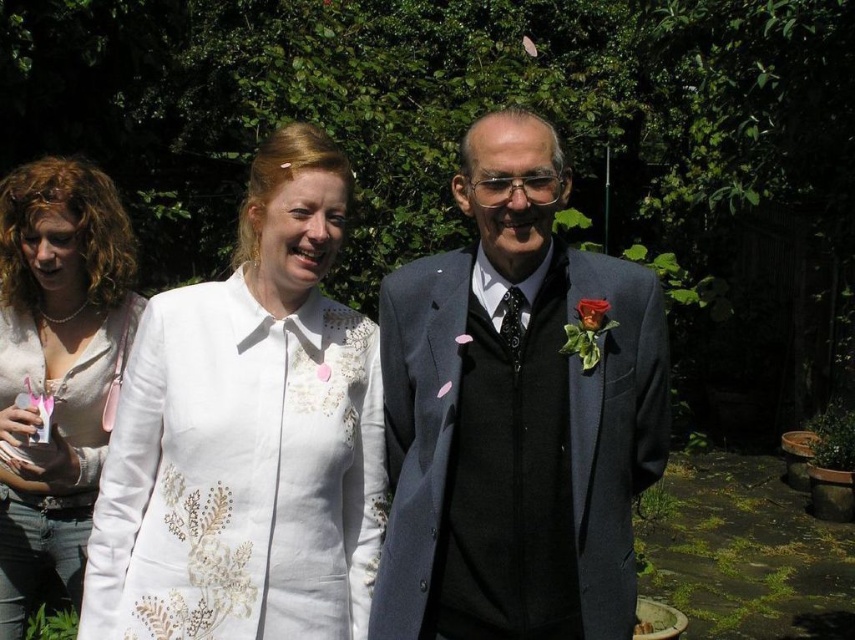
Question: Can you confirm if matte gray suit at center is bigger than matte white blouse at center?

Choices:
 (A) yes
 (B) no

Answer: (A)

Question: Is white textured coat at center in front of white embroidered blouse at center?

Choices:
 (A) yes
 (B) no

Answer: (B)

Question: Among these points, which one is nearest to the camera?

Choices:
 (A) (103, 385)
 (B) (441, 600)
 (C) (576, 435)
 (D) (164, 452)

Answer: (C)

Question: Among these objects, which one is farthest from the camera?

Choices:
 (A) white embroidered blouse at center
 (B) white textured coat at center
 (C) matte gray suit at center

Answer: (B)

Question: Which of the following is the closest to the observer?

Choices:
 (A) pyautogui.click(x=558, y=284)
 (B) pyautogui.click(x=228, y=349)

Answer: (B)

Question: Does white textured coat at center come behind matte gray suit at center?

Choices:
 (A) yes
 (B) no

Answer: (A)